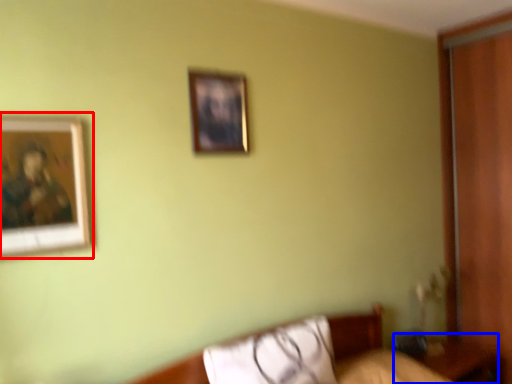
Question: Which point is further to the camera, picture frame (highlighted by a red box) or table (highlighted by a blue box)?

Choices:
 (A) picture frame
 (B) table

Answer: (B)